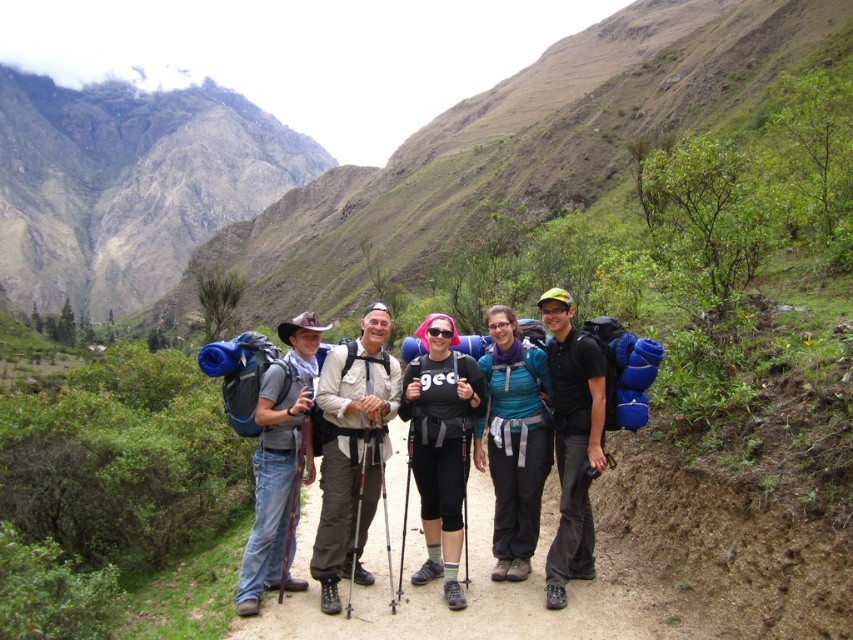
Question: Which object appears closest to the camera in this image?

Choices:
 (A) teal fabric backpack at center
 (B) blue fabric backpack at left
 (C) black matte backpack at center
 (D) green grassy mountain at upper left

Answer: (B)

Question: Based on their relative distances, which object is farther from the black matte backpack at center?

Choices:
 (A) green grassy mountain at upper left
 (B) teal fabric backpack at center
 (C) light beige fabric shirt at center
 (D) black matte backpack at right

Answer: (A)

Question: Is the position of brown dirt path at center less distant than that of black matte backpack at right?

Choices:
 (A) no
 (B) yes

Answer: (B)

Question: Based on their relative distances, which object is nearer to the teal fabric backpack at center?

Choices:
 (A) light beige fabric shirt at center
 (B) black matte backpack at center

Answer: (B)

Question: Does light beige fabric shirt at center have a smaller size compared to teal fabric backpack at center?

Choices:
 (A) yes
 (B) no

Answer: (B)

Question: Is brown dirt path at center above teal fabric backpack at center?

Choices:
 (A) yes
 (B) no

Answer: (B)